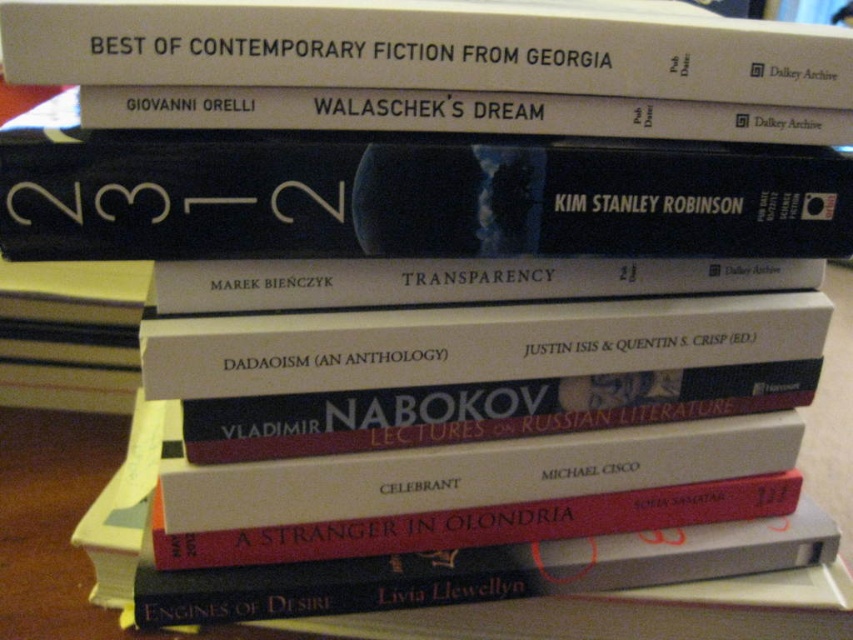
Which is behind, point (137, 172) or point (573, 60)?

The point (573, 60) is more distant.

Which is above, dark blue hardcover book at upper center or hardcover book at upper center?

hardcover book at upper center is above.

Locate an element on the screen. dark blue hardcover book at upper center is located at coordinates (405, 195).